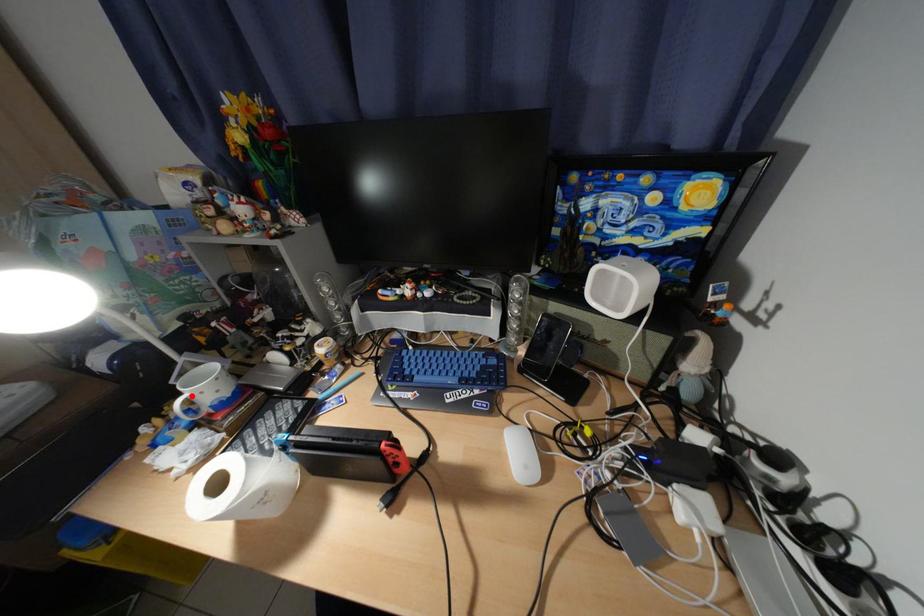
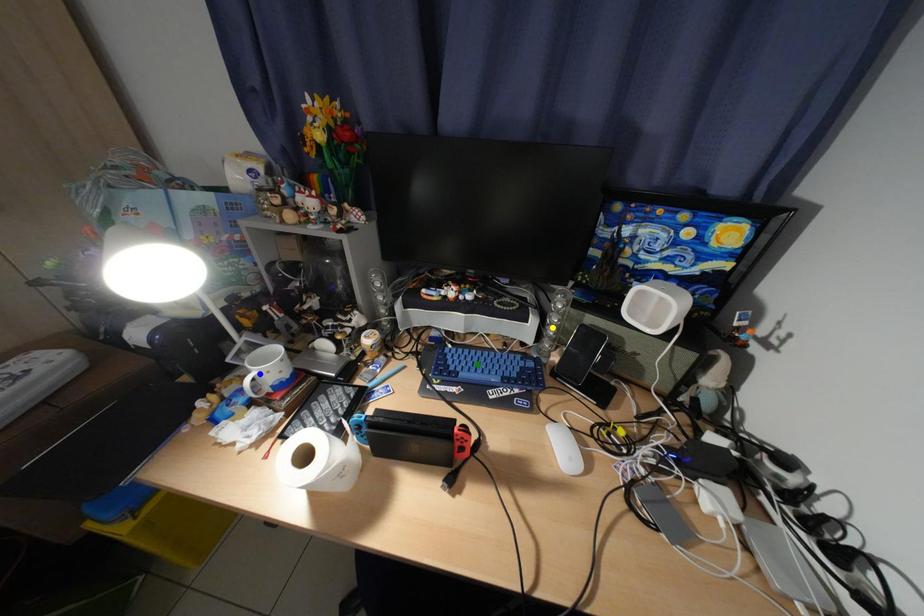
Question: I am providing you with two images of the same scene from different viewpoints. A red point is marked on the first image. You are given multiple points on the second image. Which point in image 2 represents the same 3d spot as the red point in image 1?

Choices:
 (A) yellow point
 (B) blue point
 (C) green point

Answer: (B)